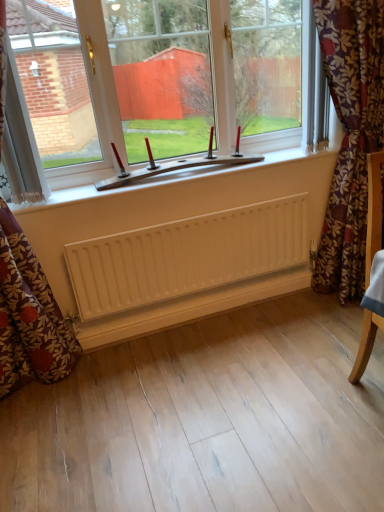
Where is `free space in front of floral fabric curtain at left, acting as the second curtain starting from the right`? free space in front of floral fabric curtain at left, acting as the second curtain starting from the right is located at coordinates click(x=57, y=429).